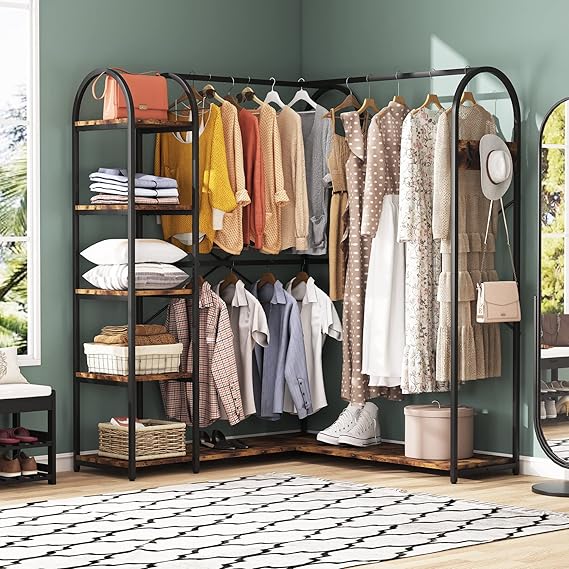
Locate an element on the screen. The height and width of the screenshot is (569, 569). pillows is located at coordinates (20, 389), (9, 365), (152, 249), (152, 271).